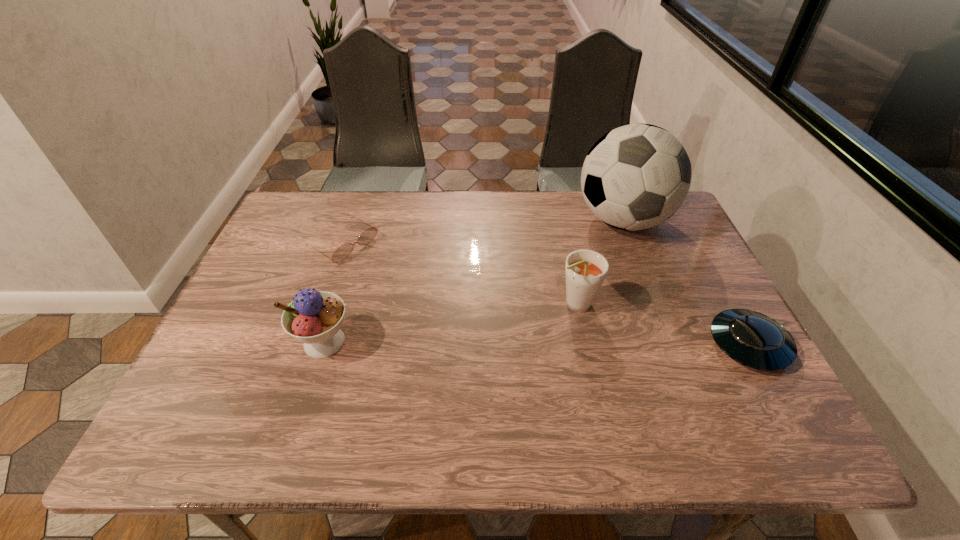
At what (x,y) coordinates should I click in order to perform the action: click on free spot at the near right corner of the desktop. Please return your answer as a coordinate pair (x, y). Image resolution: width=960 pixels, height=540 pixels. Looking at the image, I should click on (734, 383).

Identify the location of unoccupied area between the fourth tallest object and the tallest object. (685, 282).

The width and height of the screenshot is (960, 540). What are the coordinates of `vacant point located between the fourth tallest object and the icecream` in the screenshot? It's located at (537, 343).

Locate an element on the screen. The height and width of the screenshot is (540, 960). vacant area that lies between the icecream and the tallest object is located at coordinates (473, 281).

Where is `free space that is in between the fourth tallest object and the icecream`? This screenshot has width=960, height=540. free space that is in between the fourth tallest object and the icecream is located at coordinates (537, 343).

At what (x,y) coordinates should I click in order to perform the action: click on vacant space that is in between the root beer and the second shortest object. Please return your answer as a coordinate pair (x, y). Looking at the image, I should click on (662, 325).

In order to click on free space that is in between the icecream and the soccer ball in this screenshot , I will do `click(473, 281)`.

Image resolution: width=960 pixels, height=540 pixels. Identify the location of empty space between the shortest object and the root beer. (460, 274).

Where is `free point between the fourth tallest object and the soccer ball`? The width and height of the screenshot is (960, 540). free point between the fourth tallest object and the soccer ball is located at coordinates (685, 282).

Image resolution: width=960 pixels, height=540 pixels. What are the coordinates of `free spot between the soccer ball and the sunglasses` in the screenshot? It's located at (483, 232).